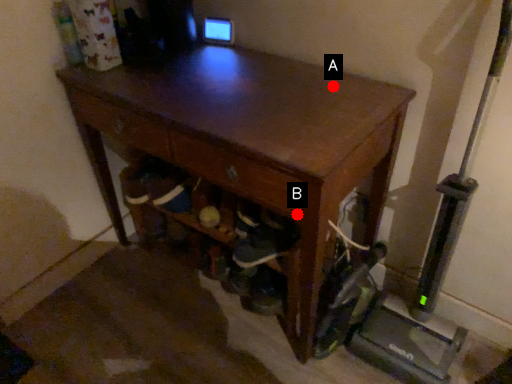
Question: Two points are circled on the image, labeled by A and B beside each circle. Among these points, which one is farthest from the camera?

Choices:
 (A) A is further
 (B) B is further

Answer: (A)